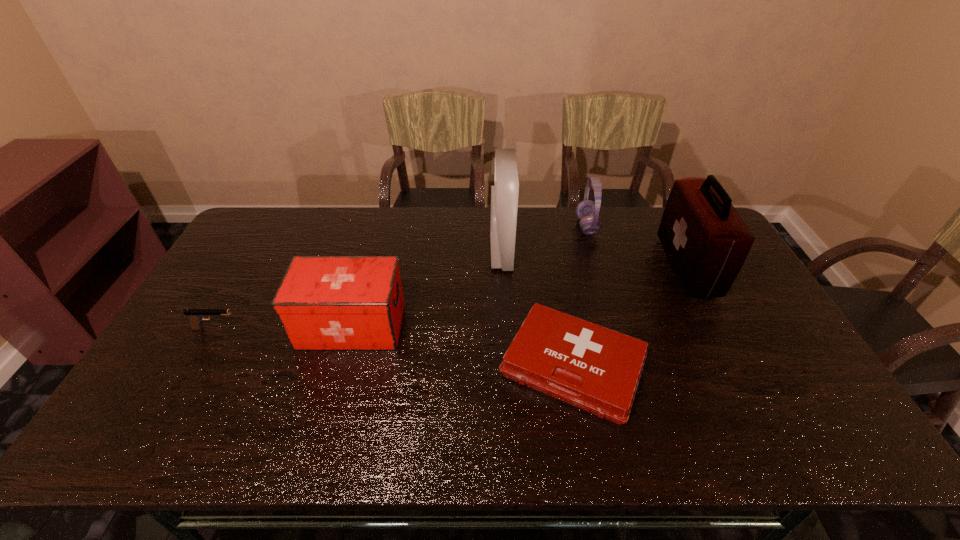
You are a GUI agent. You are given a task and a screenshot of the screen. Output one action in this format:
    pyautogui.click(x=<x>, y=<y>)
    Task: Click on the object that is at the far right corner
    Image resolution: width=960 pixels, height=540 pixels.
    Given the screenshot: What is the action you would take?
    pyautogui.click(x=706, y=241)

You are a GUI agent. You are given a task and a screenshot of the screen. Output one action in this format:
    pyautogui.click(x=<x>, y=<y>)
    Task: Click on the vacant area at the far edge
    Image resolution: width=960 pixels, height=540 pixels.
    Given the screenshot: What is the action you would take?
    pyautogui.click(x=420, y=208)

What are the coordinates of `free space at the near edge` in the screenshot? It's located at (353, 418).

The width and height of the screenshot is (960, 540). I want to click on free space at the left edge of the desktop, so click(x=244, y=317).

The height and width of the screenshot is (540, 960). I want to click on free location at the far left corner of the desktop, so (x=262, y=208).

Image resolution: width=960 pixels, height=540 pixels. In the image, there is a desktop. What are the coordinates of `vacant area at the near right corner` in the screenshot? It's located at (840, 428).

The image size is (960, 540). I want to click on empty space between the shortest object and the rightmost object, so pyautogui.click(x=630, y=316).

Find the location of a particular element. This screenshot has width=960, height=540. vacant point located between the rightmost first-aid kit and the shortest first-aid kit is located at coordinates (630, 316).

What are the coordinates of `vacant space that's between the shortest object and the headset` in the screenshot? It's located at (580, 296).

Locate an element on the screen. free point between the rightmost first-aid kit and the fifth object from right to left is located at coordinates (519, 296).